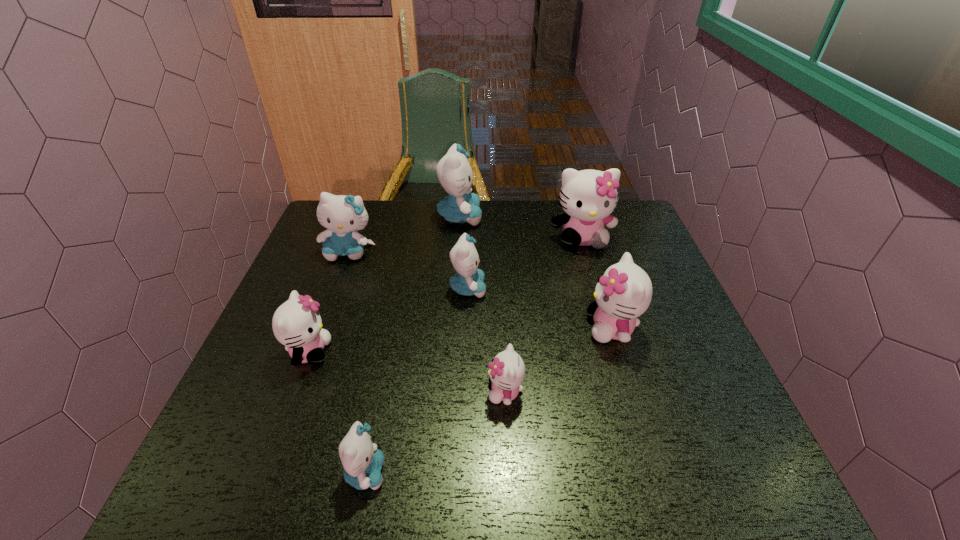
Locate an element on the screen. The image size is (960, 540). vacant space that's between the second biggest white kitten and the third farthest blue kitten is located at coordinates (540, 308).

Identify the location of vacant area between the third farthest blue kitten and the sixth object from right to left. This screenshot has height=540, width=960. pyautogui.click(x=417, y=381).

The image size is (960, 540). I want to click on empty space between the third white kitten from right to left and the leftmost white kitten, so click(407, 372).

At what (x,y) coordinates should I click in order to perform the action: click on empty space between the third object from left to right and the second white kitten from left to right. Please return your answer as a coordinate pair (x, y). Looking at the image, I should click on (436, 432).

Identify the location of unoccupied area between the second biggest white kitten and the third biggest white kitten. The width and height of the screenshot is (960, 540). click(461, 340).

Where is `empty space that is in between the third smallest white kitten and the third blue kitten from right to left`? empty space that is in between the third smallest white kitten and the third blue kitten from right to left is located at coordinates (489, 400).

Identify the location of blank region between the second biggest white kitten and the third farthest blue kitten. The height and width of the screenshot is (540, 960). (540, 308).

Identify the location of vacant area that lies between the second biggest white kitten and the sixth object from right to left. (489, 400).

The image size is (960, 540). I want to click on object that stands as the third closest to the second biggest white kitten, so click(468, 281).

This screenshot has width=960, height=540. In order to click on the closest object to the sixth kitten from right to left in this screenshot , I will do `click(296, 324)`.